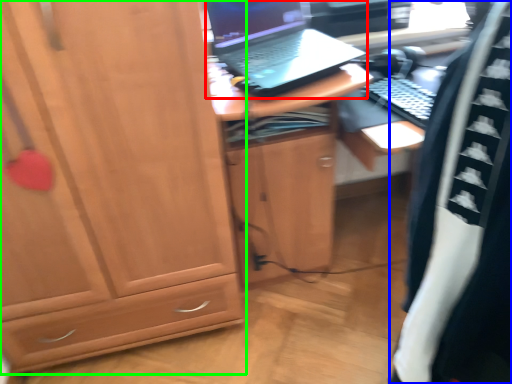
Question: Which object is positioned farthest from laptop (highlighted by a red box)? Select from clothing (highlighted by a blue box) and cabinetry (highlighted by a green box).

Choices:
 (A) clothing
 (B) cabinetry

Answer: (A)